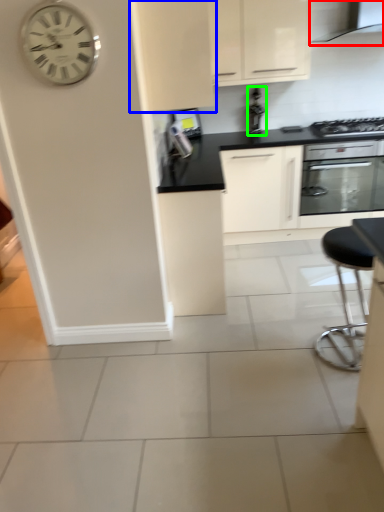
Question: Considering the real-world distances, which object is farthest from exhaust hood (highlighted by a red box)? cabinetry (highlighted by a blue box) or appliance (highlighted by a green box)?

Choices:
 (A) cabinetry
 (B) appliance

Answer: (A)